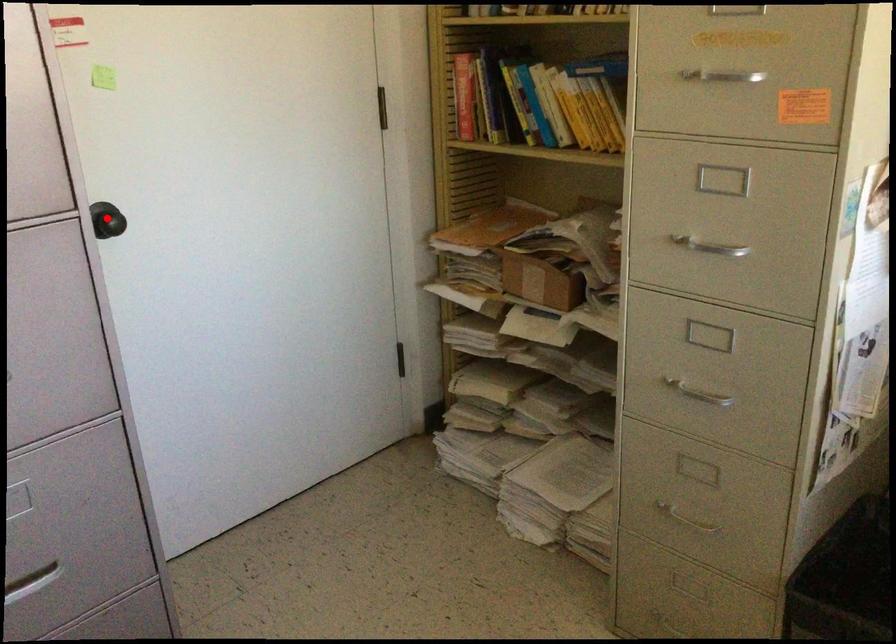
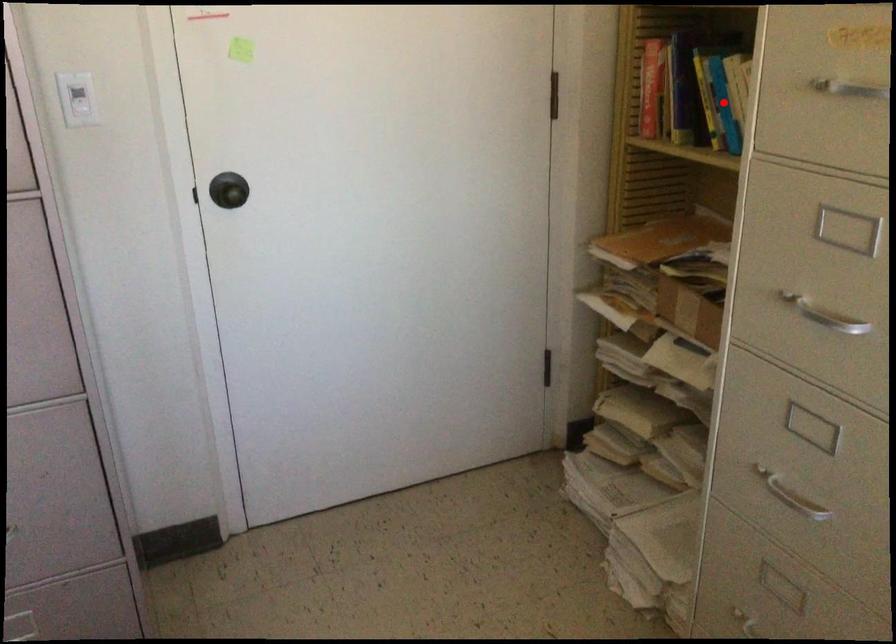
I am providing you with two images of the same scene from different viewpoints. A red point is marked on the first image and another point is marked on the second image. Does the point marked in image1 correspond to the same location as the one in image2?

No